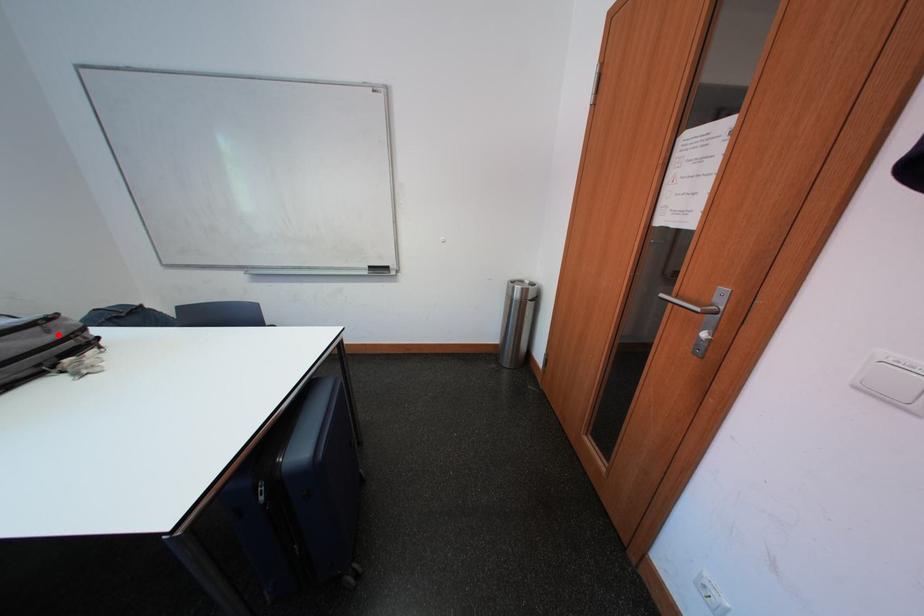
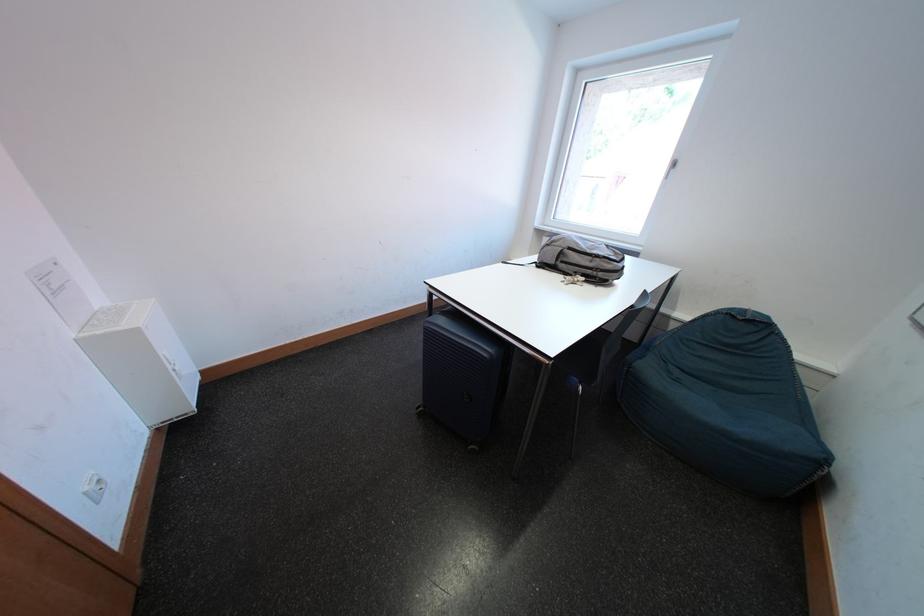
Question: I am providing you with two images of the same scene from different viewpoints. Given a red point in image1, look at the same physical point in image2. Is it:

Choices:
 (A) Closer to the viewpoint
 (B) Farther from the viewpoint

Answer: (A)